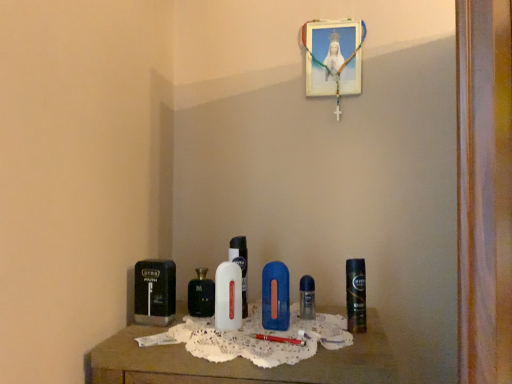
Question: Considering the relative sizes of white glossy bottle at center, marked as the 1th perfume in a front-to-back arrangement, and wooden picture frame at upper center in the image provided, is white glossy bottle at center, marked as the 1th perfume in a front-to-back arrangement, wider than wooden picture frame at upper center?

Choices:
 (A) no
 (B) yes

Answer: (B)

Question: Is white glossy bottle at center, marked as the 1th perfume in a front-to-back arrangement, not close to wooden picture frame at upper center?

Choices:
 (A) no
 (B) yes

Answer: (A)

Question: Considering the relative positions of white glossy bottle at center, positioned as the 2th perfume in left-to-right order, and wooden picture frame at upper center in the image provided, is white glossy bottle at center, positioned as the 2th perfume in left-to-right order, in front of wooden picture frame at upper center?

Choices:
 (A) yes
 (B) no

Answer: (A)

Question: Is white glossy bottle at center, the 4th perfume when ordered from back to front, positioned with its back to wooden picture frame at upper center?

Choices:
 (A) no
 (B) yes

Answer: (A)

Question: Is white glossy bottle at center, marked as the 1th perfume in a front-to-back arrangement, located outside wooden picture frame at upper center?

Choices:
 (A) no
 (B) yes

Answer: (B)

Question: Is wooden picture frame at upper center inside white glossy bottle at center, marked as the 1th perfume in a front-to-back arrangement?

Choices:
 (A) no
 (B) yes

Answer: (A)

Question: Does blue plastic razor at center, arranged as the second personal care when viewed from the right, lie in front of wooden picture frame at upper center?

Choices:
 (A) no
 (B) yes

Answer: (B)

Question: Are blue plastic razor at center, the 2th personal care from the left, and wooden picture frame at upper center far apart?

Choices:
 (A) yes
 (B) no

Answer: (B)

Question: From the image's perspective, is blue plastic razor at center, the 2th personal care from the left, under wooden picture frame at upper center?

Choices:
 (A) no
 (B) yes

Answer: (B)

Question: From a real-world perspective, is blue plastic razor at center, arranged as the second personal care when viewed from the right, on wooden picture frame at upper center?

Choices:
 (A) no
 (B) yes

Answer: (A)

Question: Is blue plastic razor at center, the 2th personal care from the left, shorter than wooden picture frame at upper center?

Choices:
 (A) yes
 (B) no

Answer: (A)

Question: From the image's perspective, is blue plastic razor at center, the 2th personal care from the left, on wooden picture frame at upper center?

Choices:
 (A) yes
 (B) no

Answer: (B)

Question: Considering the relative sizes of black plastic razor at left, which is the 3th personal care from right to left, and clear plastic perfume at center, which appears as the first perfume when viewed from the right, in the image provided, is black plastic razor at left, which is the 3th personal care from right to left, thinner than clear plastic perfume at center, which appears as the first perfume when viewed from the right,?

Choices:
 (A) yes
 (B) no

Answer: (B)